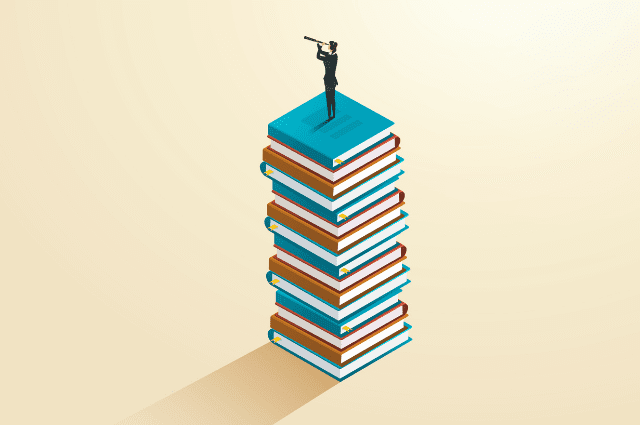
Identify the location of blue books. (338, 143), (336, 208), (356, 206), (372, 240), (347, 269), (346, 308), (349, 321), (349, 374).